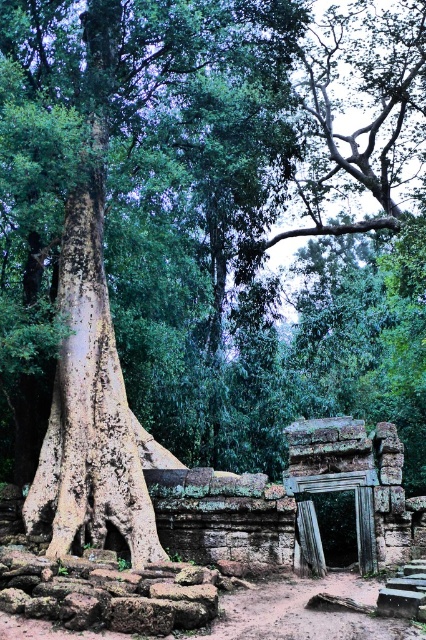
You are an archaeologist examining the site and need to access the brown rough tree root at lower center. Since the speckled bark tree trunk at left is blocking your path, can you walk around it to reach the root? Explain your reasoning based on their positions.

The brown rough tree root at lower center is behind the speckled bark tree trunk at left, so you can walk around the speckled bark tree trunk at left to access the root since it is positioned behind it.

In the scene shown: You are an archaeologist examining the ancient site. You notice the speckled bark tree trunk at left and the brown rough tree root at lower center. Which object would cast a longer shadow given their sizes and positions?

The speckled bark tree trunk at left has a larger size compared to the brown rough tree root at lower center, so it would cast a longer shadow.